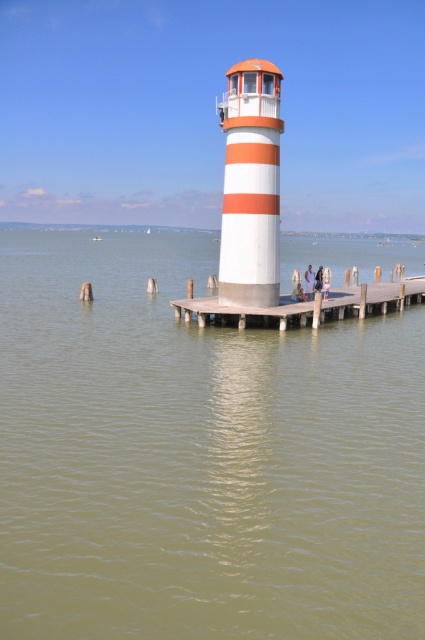
From the picture: Does greenish water at center have a lesser width compared to white fabric person at center?

No, greenish water at center is not thinner than white fabric person at center.

Based on the photo, between greenish water at center and white fabric person at center, which one has more height?

With more height is greenish water at center.

The image size is (425, 640). Describe the element at coordinates (200, 458) in the screenshot. I see `greenish water at center` at that location.

Image resolution: width=425 pixels, height=640 pixels. Find the location of `greenish water at center`. greenish water at center is located at coordinates (200, 458).

Is wooden dock at center above white fabric person at center?

No.

Which is above, wooden dock at center or white fabric person at center?

white fabric person at center is above.

Is point (362, 292) closer to viewer compared to point (309, 268)?

Yes.

Where is `wooden dock at center`? Image resolution: width=425 pixels, height=640 pixels. wooden dock at center is located at coordinates (308, 307).

Does greenish water at center appear on the right side of white matte person at center?

Incorrect, greenish water at center is not on the right side of white matte person at center.

The width and height of the screenshot is (425, 640). What do you see at coordinates (200, 458) in the screenshot? I see `greenish water at center` at bounding box center [200, 458].

From the picture: Who is more forward, (300, 586) or (300, 292)?

Positioned in front is point (300, 586).

I want to click on greenish water at center, so click(200, 458).